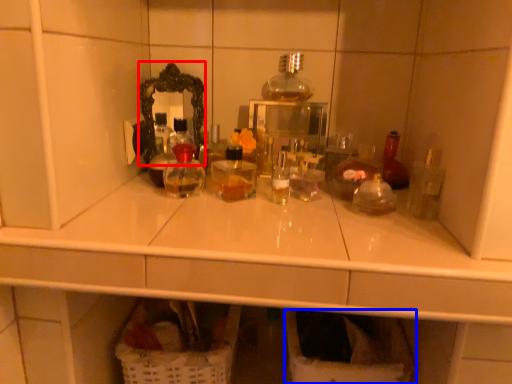
Question: Which of the following is the farthest to the observer, mirror (highlighted by a red box) or laundry basket (highlighted by a blue box)?

Choices:
 (A) mirror
 (B) laundry basket

Answer: (A)